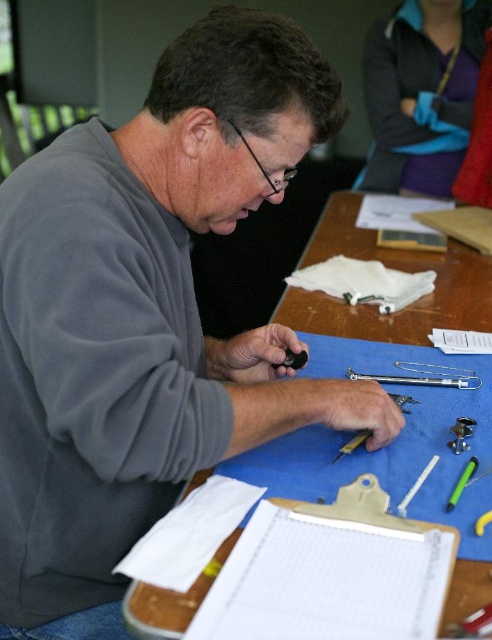
Question: Can you confirm if gray fleece at center is positioned to the right of chrome metallic syringe at center?

Choices:
 (A) yes
 (B) no

Answer: (B)

Question: Can you confirm if white paper at lower center is smaller than blue fabric at center?

Choices:
 (A) yes
 (B) no

Answer: (A)

Question: Can you confirm if white paper at lower center is positioned to the left of metallic silver screwdriver at center?

Choices:
 (A) yes
 (B) no

Answer: (A)

Question: Among these points, which one is farthest from the camera?

Choices:
 (A) (450, 387)
 (B) (352, 524)
 (C) (338, 269)
 (D) (350, 234)

Answer: (D)

Question: Which object is positioned farthest from the chrome metallic syringe at center?

Choices:
 (A) white paper at lower center
 (B) gray fleece at center
 (C) blue fabric at center

Answer: (B)

Question: Which object is farther from the camera taking this photo?

Choices:
 (A) white cloth at center
 (B) chrome metallic syringe at center

Answer: (A)